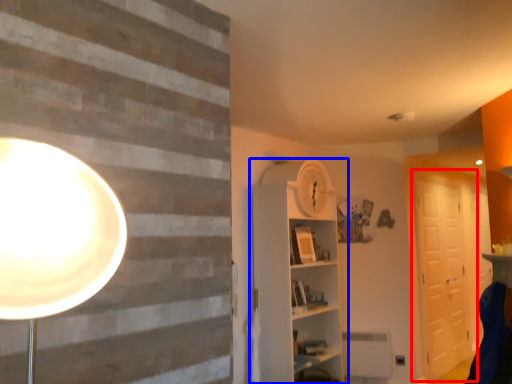
Question: Among these objects, which one is nearest to the camera, barn door (highlighted by a red box) or shelf (highlighted by a blue box)?

Choices:
 (A) barn door
 (B) shelf

Answer: (B)